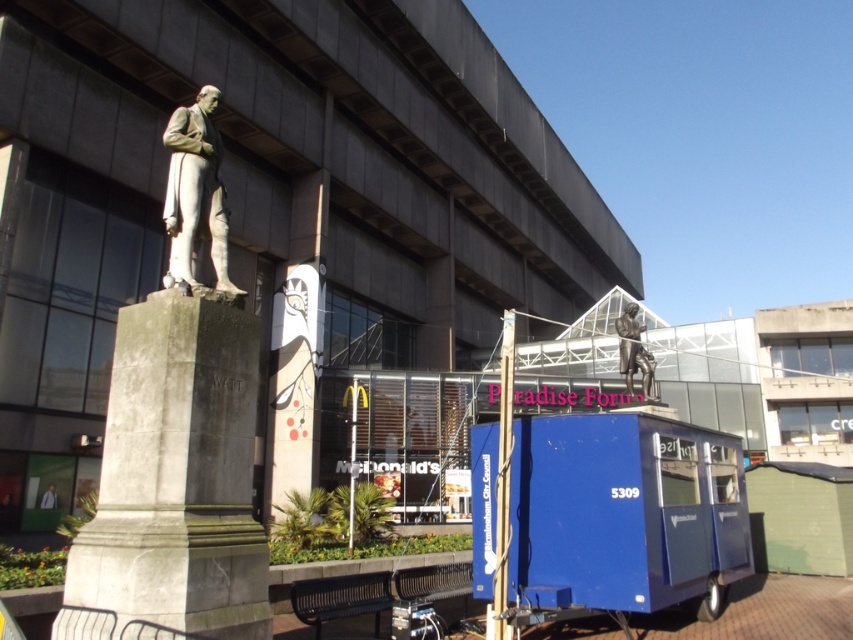
You are a tourist standing in front of the statue and want to take a photo that includes both the polished bronze statue at left and the polished bronze statue at upper center. Which statue should you move closer to in order to capture both in the frame?

To capture both the polished bronze statue at left and the polished bronze statue at upper center in the frame, you should move closer to the polished bronze statue at upper center since it is farther away from the viewer compared to the one at left.

You are standing at the center of the urban scene and want to take a photo of the gray stone monument at left. Which direction should you face to ensure the monument is in the frame?

The gray stone monument at left is located at point (177,476), so you should face to the left to ensure the monument is in the frame.

You are a photographer trying to capture both the polished bronze statue at left and the light brown leather jacket at lower left in the same frame. Which object should you focus on first to ensure both are in focus?

You should focus on the polished bronze statue at left first since it is closer to the viewer than the light brown leather jacket at lower left, ensuring both will be in focus when focused on the closer object.